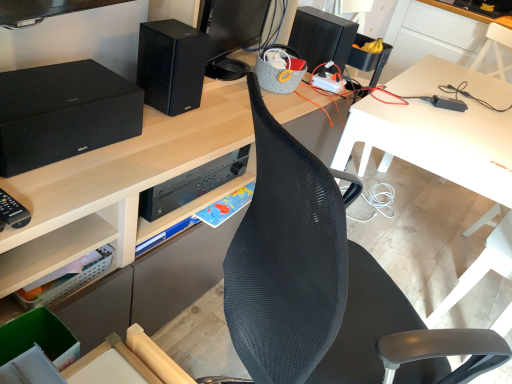
Question: Considering the relative sizes of matte black speaker at left, positioned as the 1th speaker in left-to-right order, and black matte speaker at upper center, which ranks as the second speaker in right-to-left order, in the image provided, is matte black speaker at left, positioned as the 1th speaker in left-to-right order, bigger than black matte speaker at upper center, which ranks as the second speaker in right-to-left order,?

Choices:
 (A) yes
 (B) no

Answer: (A)

Question: Is there a large distance between matte black speaker at left, arranged as the 3th speaker when viewed from the back, and black matte speaker at upper center, which is the second speaker from front to back?

Choices:
 (A) yes
 (B) no

Answer: (B)

Question: From a real-world perspective, is matte black speaker at left, which appears as the third speaker when viewed from the right, on top of black matte speaker at upper center, the 2th speaker from the back?

Choices:
 (A) no
 (B) yes

Answer: (A)

Question: Is matte black speaker at left, positioned as the 1th speaker in left-to-right order, at the right side of black matte speaker at upper center, which is the second speaker from front to back?

Choices:
 (A) no
 (B) yes

Answer: (A)

Question: Is matte black speaker at left, which appears as the third speaker when viewed from the right, oriented away from black matte speaker at upper center, which ranks as the second speaker in right-to-left order?

Choices:
 (A) yes
 (B) no

Answer: (B)

Question: Is matte black speaker at left, the first speaker positioned from the front, behind black matte speaker at upper center, the 2th speaker from the back?

Choices:
 (A) no
 (B) yes

Answer: (A)

Question: Is clear plastic basket at lower left turned away from black matte speaker at upper center, the 2th speaker from the back?

Choices:
 (A) no
 (B) yes

Answer: (A)

Question: Is clear plastic basket at lower left positioned beyond the bounds of black matte speaker at upper center, which is the second speaker from front to back?

Choices:
 (A) yes
 (B) no

Answer: (A)

Question: Can you confirm if clear plastic basket at lower left is positioned to the left of black matte speaker at upper center, the 2th speaker from the back?

Choices:
 (A) no
 (B) yes

Answer: (B)

Question: Considering the relative sizes of clear plastic basket at lower left and black matte speaker at upper center, the 2th speaker from the back, in the image provided, is clear plastic basket at lower left taller than black matte speaker at upper center, the 2th speaker from the back,?

Choices:
 (A) yes
 (B) no

Answer: (B)

Question: From a real-world perspective, does clear plastic basket at lower left stand above black matte speaker at upper center, which ranks as the second speaker in right-to-left order?

Choices:
 (A) no
 (B) yes

Answer: (A)

Question: Does clear plastic basket at lower left have a smaller size compared to black matte speaker at upper center, the 2th speaker from the back?

Choices:
 (A) yes
 (B) no

Answer: (A)

Question: From the image's perspective, is white plastic table at upper right, the 2th table positioned from the bottom, beneath clear plastic basket at lower left?

Choices:
 (A) no
 (B) yes

Answer: (A)